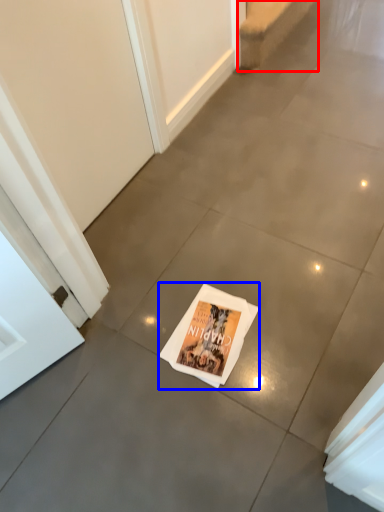
Question: Among these objects, which one is farthest to the camera, stairwell (highlighted by a red box) or magazine (highlighted by a blue box)?

Choices:
 (A) stairwell
 (B) magazine

Answer: (A)